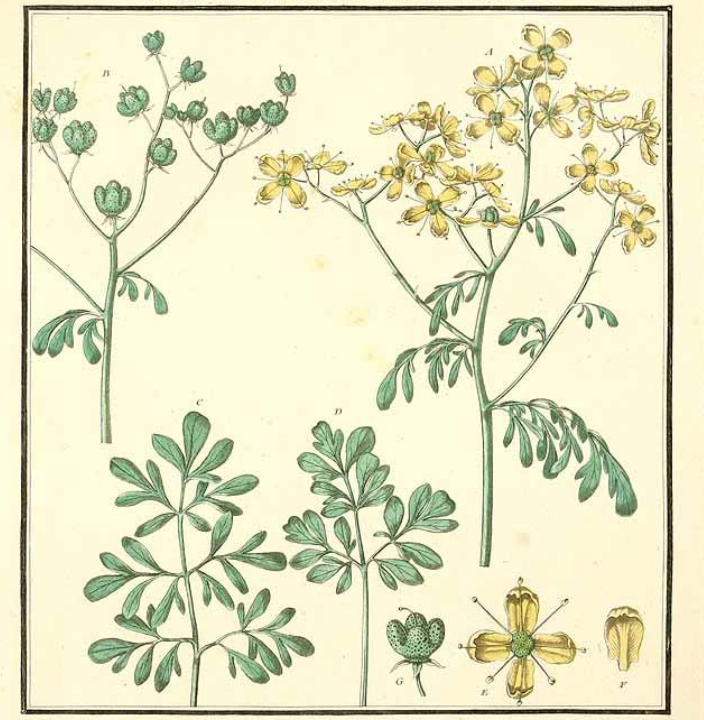
You are a GUI agent. You are given a task and a screenshot of the screen. Output one action in this format:
    pyautogui.click(x=<x>, y=<y>)
    Task: Click on the picture border in balck
    
    Given the screenshot: What is the action you would take?
    pyautogui.click(x=667, y=692)